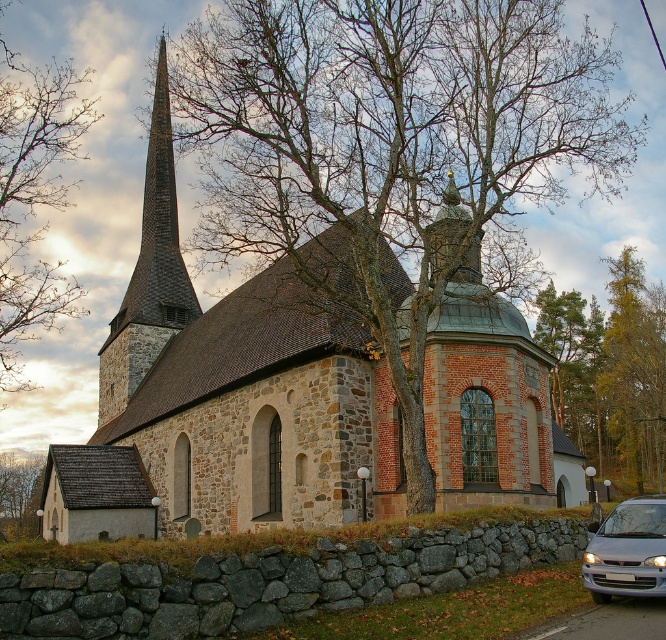
Question: Which point appears closest to the camera in this image?

Choices:
 (A) (256, 369)
 (B) (21, 522)
 (C) (151, 308)

Answer: (A)

Question: Does stone church at center have a greater width compared to dark brown stone steeple at upper left?

Choices:
 (A) yes
 (B) no

Answer: (A)

Question: Which of these objects is positioned farthest from the silver metallic car at lower right?

Choices:
 (A) dark brown stone steeple at upper left
 (B) brown bark tree at lower left
 (C) stone church at center
 (D) green leafy tree at upper center

Answer: (B)

Question: Is silver metallic car at lower right smaller than brown bark tree at lower left?

Choices:
 (A) no
 (B) yes

Answer: (B)

Question: Which of the following is the farthest from the observer?

Choices:
 (A) (593, 308)
 (B) (9, 529)
 (C) (184, 301)
 (D) (218, 474)

Answer: (B)

Question: Does bare branches at left come in front of brown bark tree at lower left?

Choices:
 (A) yes
 (B) no

Answer: (A)